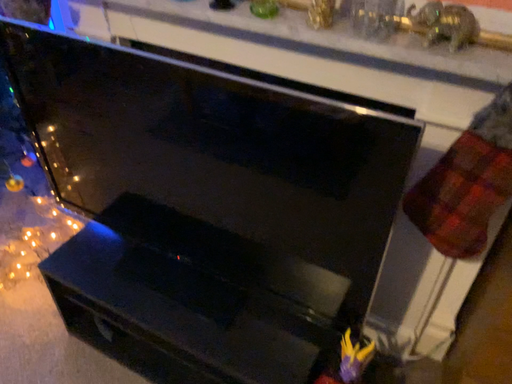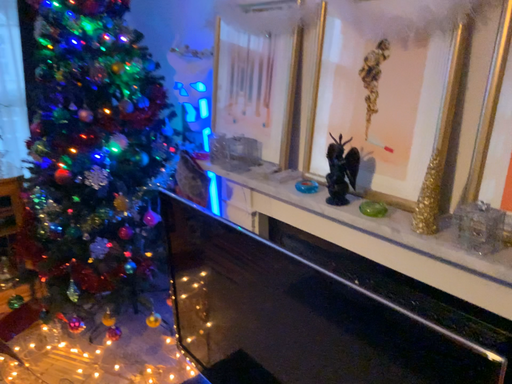
Question: Which way did the camera rotate in the video?

Choices:
 (A) rotated upward
 (B) rotated downward

Answer: (A)